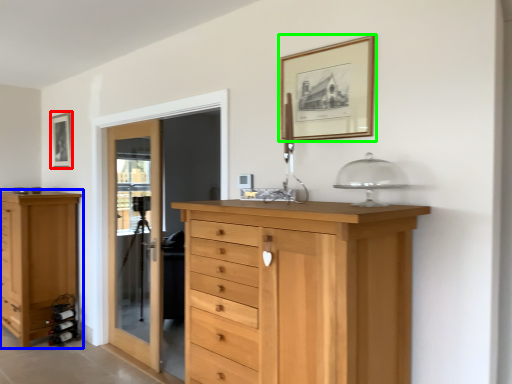
Question: Which is farther away from picture frame (highlighted by a red box)? chest of drawers (highlighted by a blue box) or picture frame (highlighted by a green box)?

Choices:
 (A) chest of drawers
 (B) picture frame

Answer: (B)